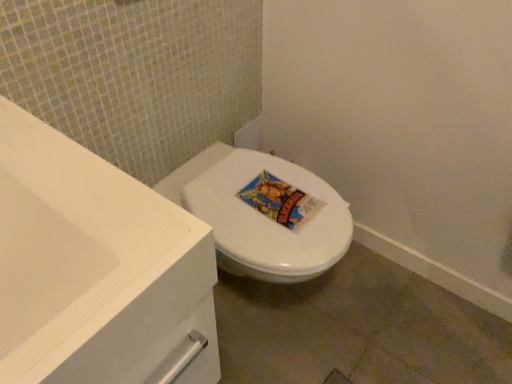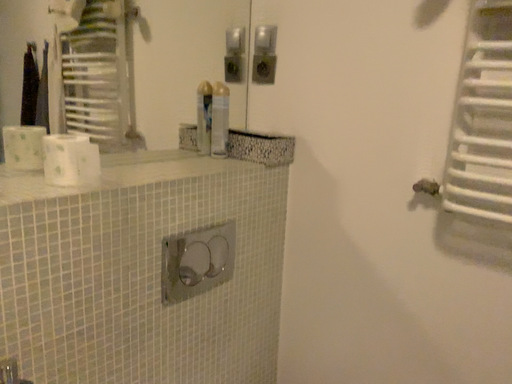
Question: Which way did the camera rotate in the video?

Choices:
 (A) rotated upward
 (B) rotated downward

Answer: (A)